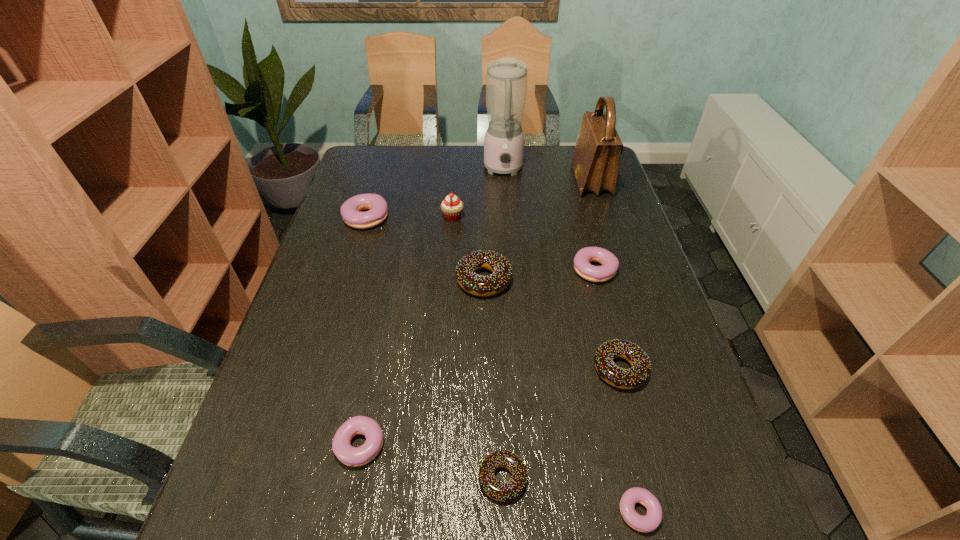
Where is `the second nearest purple doughnut`? the second nearest purple doughnut is located at coordinates (351, 456).

Where is `the second doughnut from left to right`? the second doughnut from left to right is located at coordinates (351, 456).

Find the location of `the nearest chocolate doughnut`. the nearest chocolate doughnut is located at coordinates (507, 491).

Identify the location of the shortest doughnut. The image size is (960, 540). (649, 522).

What are the coordinates of `the nearest purple doughnut` in the screenshot? It's located at (649, 522).

This screenshot has width=960, height=540. In order to click on vacant space situated 0.390m on the base of the food processor near the control knob in this screenshot , I will do `click(510, 261)`.

Image resolution: width=960 pixels, height=540 pixels. Identify the location of free location located 0.390m on the front flap of the shoulder bag. (461, 180).

What are the coordinates of `vacant space located 0.380m on the front flap of the shoulder bag` in the screenshot? It's located at (464, 180).

Where is `vacant area situated on the front flap of the shoulder bag`? The image size is (960, 540). vacant area situated on the front flap of the shoulder bag is located at coordinates (472, 180).

At what (x,y) coordinates should I click in order to perform the action: click on vacant space situated 0.060m on the left of the third tallest object. Please return your answer as a coordinate pair (x, y). Image resolution: width=960 pixels, height=540 pixels. Looking at the image, I should click on (422, 217).